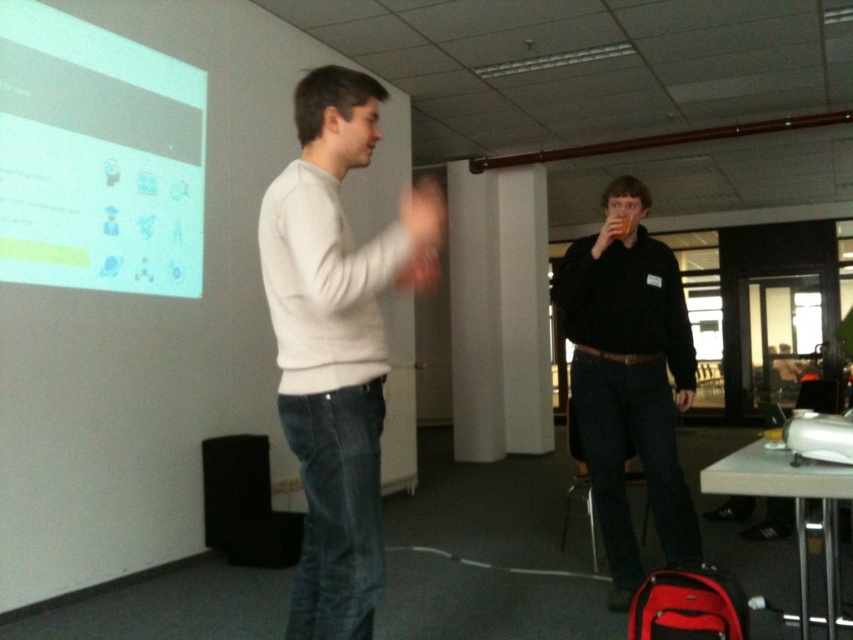
Question: Among these objects, which one is nearest to the camera?

Choices:
 (A) black matte shirt at center
 (B) white glossy projection screen at upper left
 (C) light gray sweater at center

Answer: (C)

Question: Is light gray sweater at center to the left of white glossy projection screen at upper left from the viewer's perspective?

Choices:
 (A) no
 (B) yes

Answer: (A)

Question: Does light gray sweater at center have a lesser width compared to black matte shirt at center?

Choices:
 (A) yes
 (B) no

Answer: (A)

Question: Which point is farther to the camera?

Choices:
 (A) (662, 502)
 (B) (163, 67)

Answer: (B)

Question: Which object appears closest to the camera in this image?

Choices:
 (A) white glossy projection screen at upper left
 (B) black matte shirt at center

Answer: (B)

Question: Is light gray sweater at center above black matte shirt at center?

Choices:
 (A) yes
 (B) no

Answer: (A)